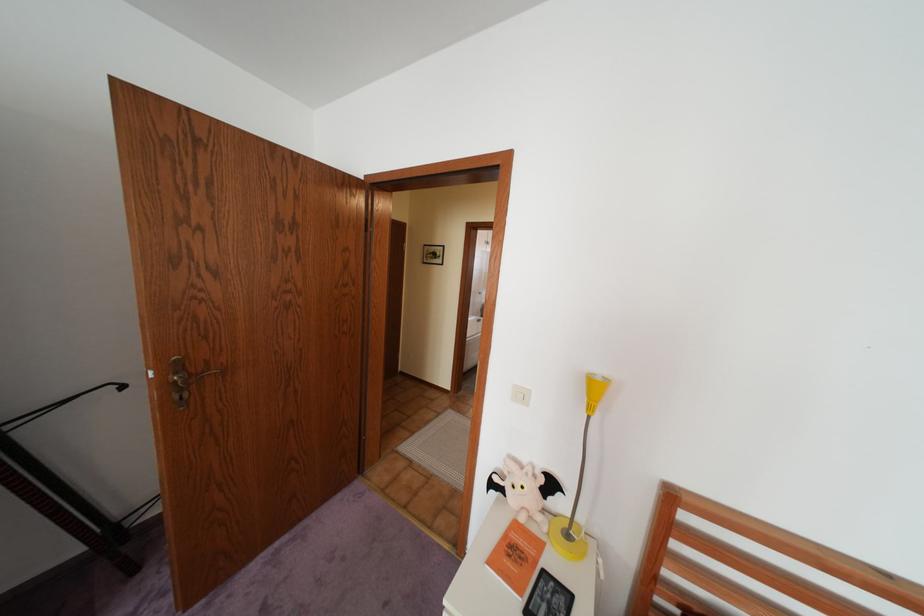
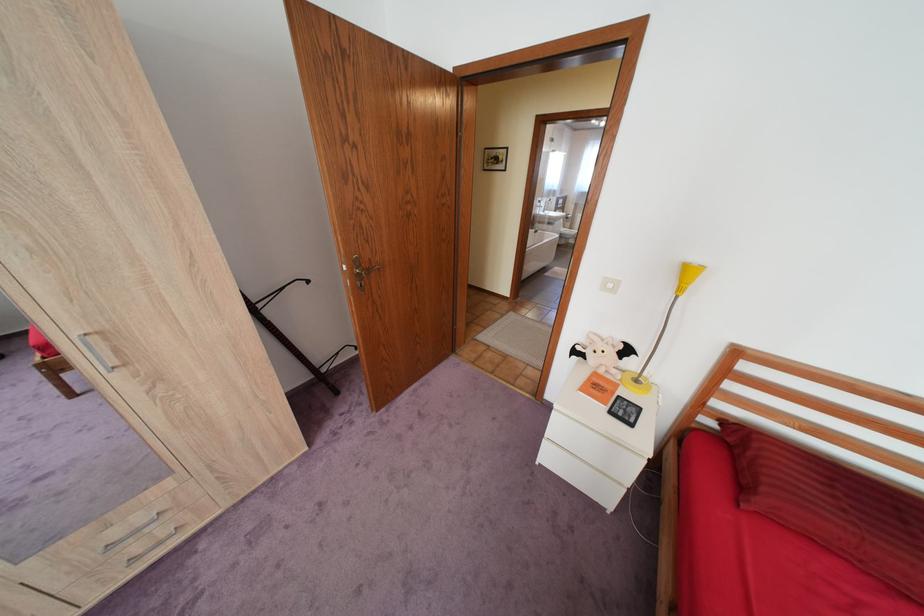
In the second image, find the point that corresponds to the point at 523,551 in the first image.

(606, 386)